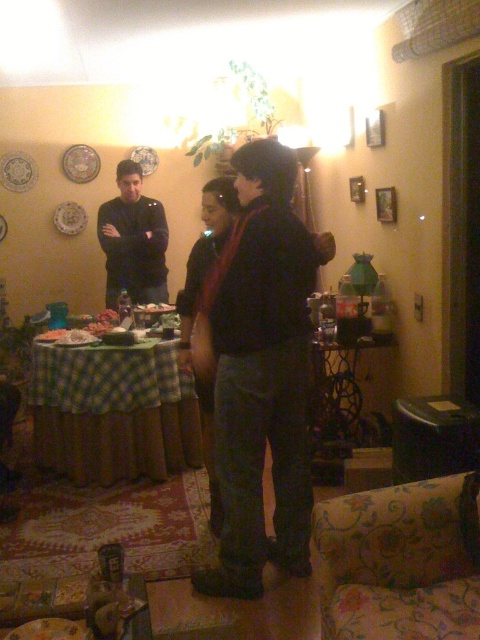
You are a guest at this gathering and want to place your coat on the nearest available space. Which object between the green checkered tablecloth at center and the black matte shirt at center would you choose, and why?

The black matte shirt at center occupies more space than the green checkered tablecloth at center, so you should place your coat on the black matte shirt at center because it has more space available.

You are a photographer setting up a shoot in this room. You need to position a light source so it illuminates both the dark gray pants at center and the black matte shirt at center without casting shadows on the walls. Considering their heights, which object should the light be placed above?

The light should be placed above the dark gray pants at center because it is taller than the black matte shirt at center, so positioning the light above it would ensure both items are illuminated without casting shadows on the walls.

You are a guest at this gathering and need to find the dark gray pants at center and the black matte shirt at center. How far apart are they?

The dark gray pants at center and the black matte shirt at center are 6.53 feet apart.